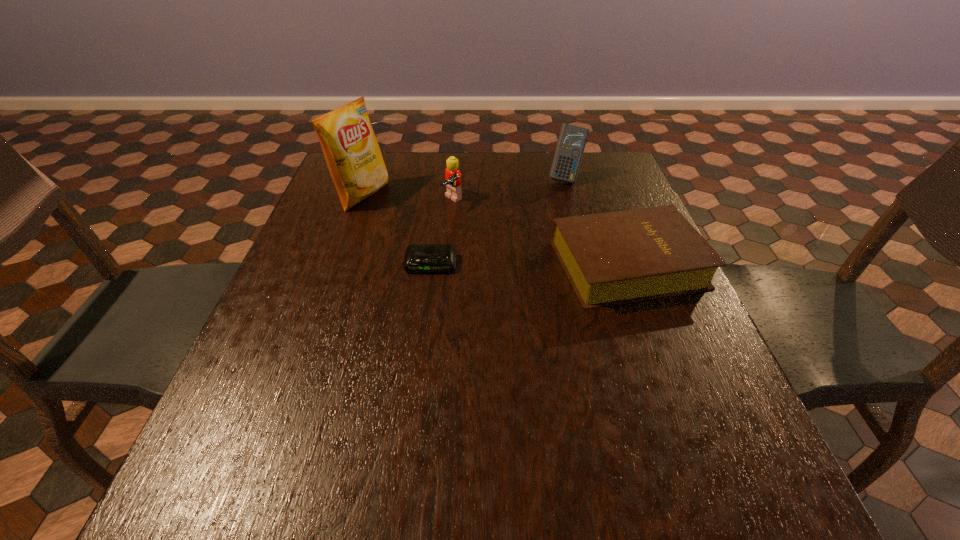
Identify the location of vacant space at the far right corner of the desktop. The height and width of the screenshot is (540, 960). (584, 155).

The width and height of the screenshot is (960, 540). I want to click on free space at the near right corner of the desktop, so click(x=710, y=401).

This screenshot has width=960, height=540. What are the coordinates of `vacant area between the shortest object and the Bible` in the screenshot? It's located at (529, 264).

Locate an element on the screen. vacant space in between the Lego and the Bible is located at coordinates click(540, 233).

At what (x,y) coordinates should I click in order to perform the action: click on unoccupied area between the Lego and the tallest object. Please return your answer as a coordinate pair (x, y). The image size is (960, 540). Looking at the image, I should click on pyautogui.click(x=408, y=198).

Identify the location of empty location between the calculator and the third tallest object. (509, 190).

Where is `free space between the fourth shortest object and the alarm clock`? The width and height of the screenshot is (960, 540). free space between the fourth shortest object and the alarm clock is located at coordinates (498, 221).

Locate an element on the screen. This screenshot has height=540, width=960. vacant area that lies between the leftmost object and the fourth shortest object is located at coordinates (465, 186).

At what (x,y) coordinates should I click in order to perform the action: click on empty space that is in between the fourth tallest object and the Lego. Please return your answer as a coordinate pair (x, y). The width and height of the screenshot is (960, 540). Looking at the image, I should click on (540, 233).

Image resolution: width=960 pixels, height=540 pixels. I want to click on empty space between the tallest object and the alarm clock, so click(397, 230).